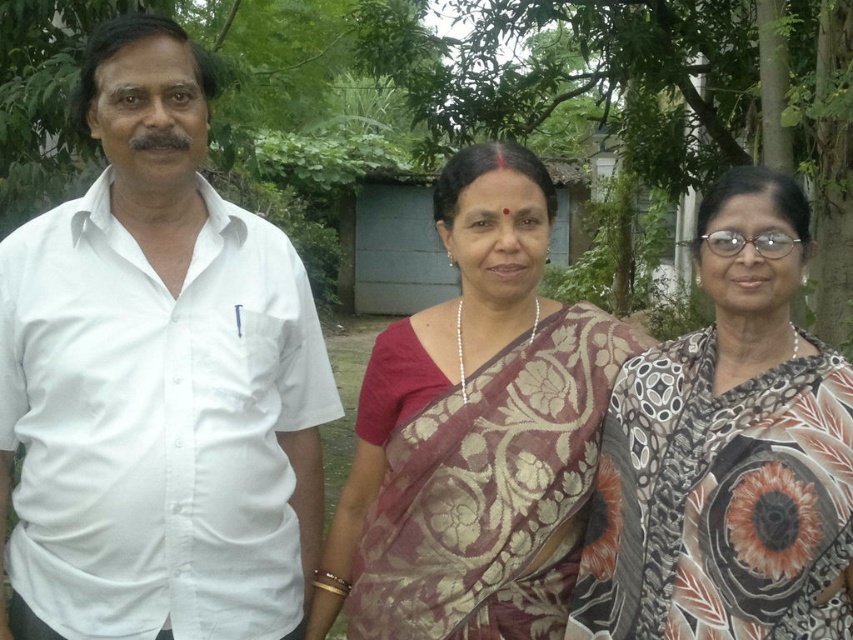
Consider the image. You are standing in a rural area and want to reach a specific point marked at coordinates point (90, 314). If you can walk 7 feet in one minute, how long will it take you to reach that point?

The distance of point (90, 314) from viewer is 6.78 feet. Since you can walk 7 feet in one minute, it will take approximately 0.97 minutes, which is about 58 seconds, to reach the point.

You are a photographer positioned at the back of the scene. You want to take a photo of the white cotton shirt at left and the maroon floral saree at center. Which one will appear larger in the photo?

The white cotton shirt at left will appear larger in the photo because it is closer to the viewer than the maroon floral saree at center.

You are a photographer trying to capture a photo of the maroon floral saree at center and the green leafy tree at center. Which object should you focus on first if you want to include both in your shot without moving the camera?

The maroon floral saree at center is positioned on the left side of the green leafy tree at center, so you should focus on the maroon floral saree at center first to ensure both are in frame without moving the camera.